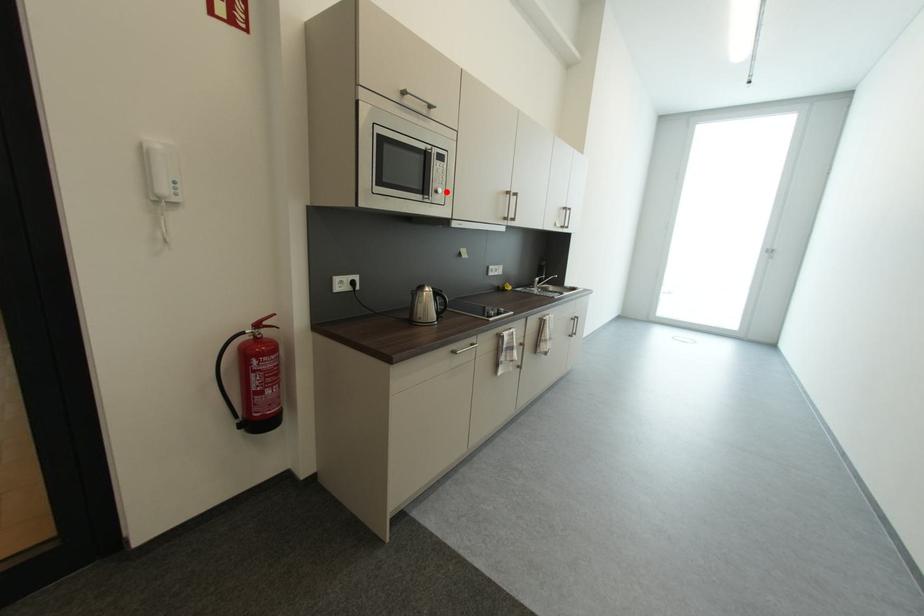
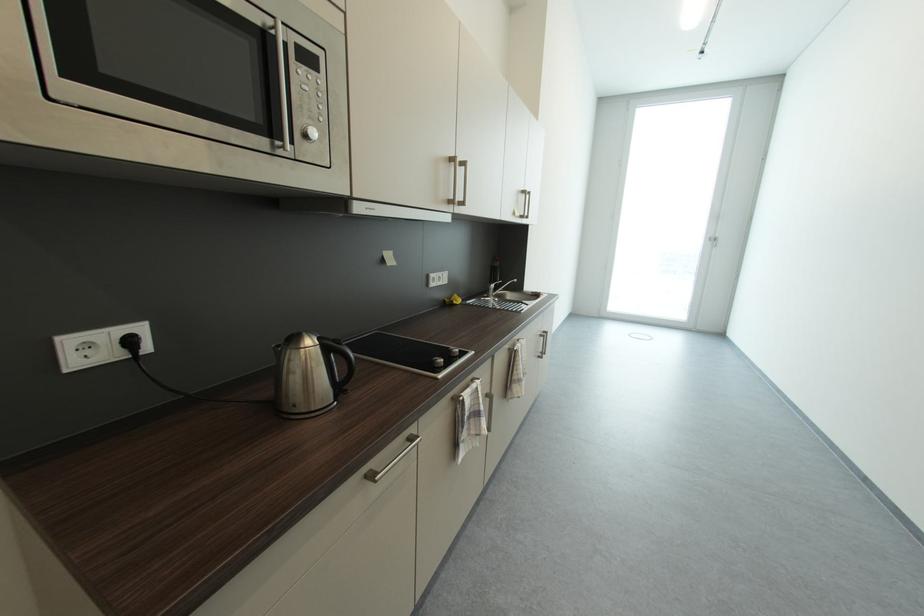
Locate, in the second image, the point that corresponds to the highlighted location in the first image.

(321, 134)